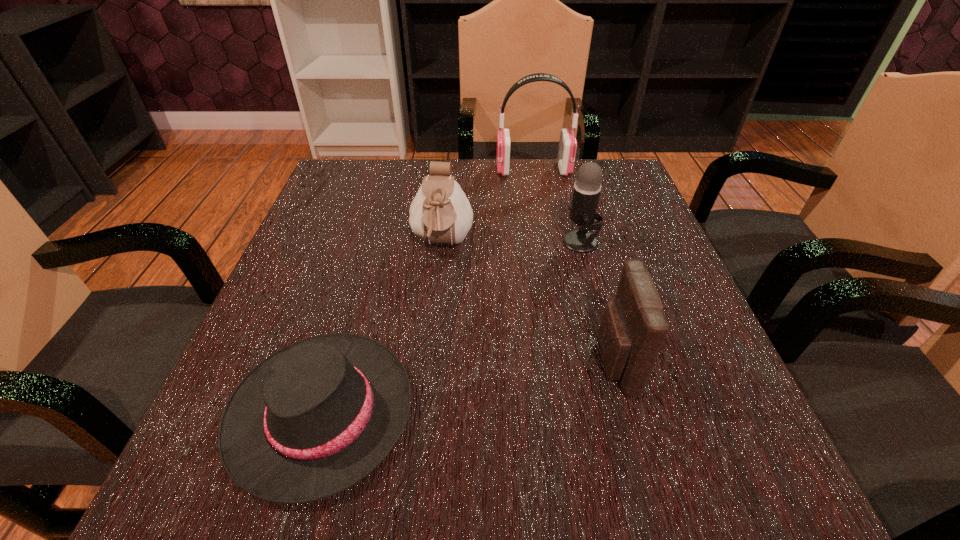
The height and width of the screenshot is (540, 960). I want to click on free spot located on the front-facing side of the farther pouch, so click(422, 444).

Locate an element on the screen. This screenshot has height=540, width=960. vacant space located 0.180m with an open flap on the nearer pouch is located at coordinates (482, 362).

The width and height of the screenshot is (960, 540). I want to click on free space located with an open flap on the nearer pouch, so click(527, 362).

The width and height of the screenshot is (960, 540). Identify the location of free space located with an open flap on the nearer pouch. (380, 362).

Identify the location of vacant area located on the right of the dress hat. (454, 413).

You are a GUI agent. You are given a task and a screenshot of the screen. Output one action in this format:
    pyautogui.click(x=<x>, y=<y>)
    Task: Click on the object that is positioned at the far edge
    
    Given the screenshot: What is the action you would take?
    pyautogui.click(x=567, y=148)

Where is `object that is at the near edge`? Image resolution: width=960 pixels, height=540 pixels. object that is at the near edge is located at coordinates (314, 418).

You are a GUI agent. You are given a task and a screenshot of the screen. Output one action in this format:
    pyautogui.click(x=<x>, y=<y>)
    Task: Click on the object at the left edge
    The image size is (960, 540).
    Given the screenshot: What is the action you would take?
    pyautogui.click(x=314, y=418)

You are a GUI agent. You are given a task and a screenshot of the screen. Output one action in this format:
    pyautogui.click(x=<x>, y=<y>)
    Task: Click on the earphone that is at the right edge
    The height and width of the screenshot is (540, 960).
    Given the screenshot: What is the action you would take?
    pyautogui.click(x=567, y=148)

Image resolution: width=960 pixels, height=540 pixels. What are the coordinates of `microphone that is positioned at the right edge` in the screenshot? It's located at (587, 187).